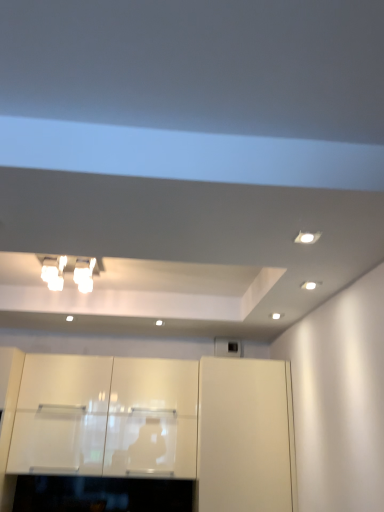
Question: Considering the relative positions of glossy white cabinets at center, which is the second cabinetry from left to right, and white glossy cabinet at center, positioned as the first cabinetry in right-to-left order, in the image provided, is glossy white cabinets at center, which is the second cabinetry from left to right, to the left of white glossy cabinet at center, positioned as the first cabinetry in right-to-left order, from the viewer's perspective?

Choices:
 (A) no
 (B) yes

Answer: (B)

Question: Can you confirm if glossy white cabinets at center, which is the second cabinetry from left to right, is thinner than white glossy cabinet at center, the 3th cabinetry in the left-to-right sequence?

Choices:
 (A) no
 (B) yes

Answer: (B)

Question: Is glossy white cabinets at center, which is the second cabinetry from left to right, far away from white glossy cabinet at center, the 3th cabinetry in the left-to-right sequence?

Choices:
 (A) no
 (B) yes

Answer: (A)

Question: Would you say white glossy cabinet at center, positioned as the first cabinetry in right-to-left order, is part of glossy white cabinets at center, which is the second cabinetry from left to right,'s contents?

Choices:
 (A) yes
 (B) no

Answer: (B)

Question: From the image's perspective, would you say glossy white cabinets at center, which is the second cabinetry from left to right, is shown under white glossy cabinet at center, positioned as the first cabinetry in right-to-left order?

Choices:
 (A) no
 (B) yes

Answer: (A)

Question: Is glossy white cabinets at center, which is counted as the second cabinetry, starting from the right, smaller than white glossy cabinet at center, positioned as the first cabinetry in right-to-left order?

Choices:
 (A) yes
 (B) no

Answer: (A)

Question: From the image's perspective, is white glossy cabinet at center, the third cabinetry positioned from the right, on white glossy cabinet at center, positioned as the first cabinetry in right-to-left order?

Choices:
 (A) yes
 (B) no

Answer: (A)

Question: Considering the relative sizes of white glossy cabinet at center, the third cabinetry positioned from the right, and white glossy cabinet at center, the 3th cabinetry in the left-to-right sequence, in the image provided, is white glossy cabinet at center, the third cabinetry positioned from the right, wider than white glossy cabinet at center, the 3th cabinetry in the left-to-right sequence,?

Choices:
 (A) yes
 (B) no

Answer: (B)

Question: Considering the relative sizes of white glossy cabinet at center, the third cabinetry positioned from the right, and white glossy cabinet at center, the 3th cabinetry in the left-to-right sequence, in the image provided, is white glossy cabinet at center, the third cabinetry positioned from the right, thinner than white glossy cabinet at center, the 3th cabinetry in the left-to-right sequence,?

Choices:
 (A) no
 (B) yes

Answer: (B)

Question: Can you confirm if white glossy cabinet at center, which is the 1th cabinetry from left to right, is bigger than white glossy cabinet at center, positioned as the first cabinetry in right-to-left order?

Choices:
 (A) no
 (B) yes

Answer: (A)

Question: Does white glossy cabinet at center, which is the 1th cabinetry from left to right, appear on the left side of white glossy cabinet at center, positioned as the first cabinetry in right-to-left order?

Choices:
 (A) yes
 (B) no

Answer: (A)

Question: From the image's perspective, is white glossy cabinet at center, which is the 1th cabinetry from left to right, below white glossy cabinet at center, positioned as the first cabinetry in right-to-left order?

Choices:
 (A) yes
 (B) no

Answer: (B)

Question: Is the position of white glossy light fixture at upper left more distant than that of glossy white cabinets at center, which is counted as the second cabinetry, starting from the right?

Choices:
 (A) yes
 (B) no

Answer: (B)